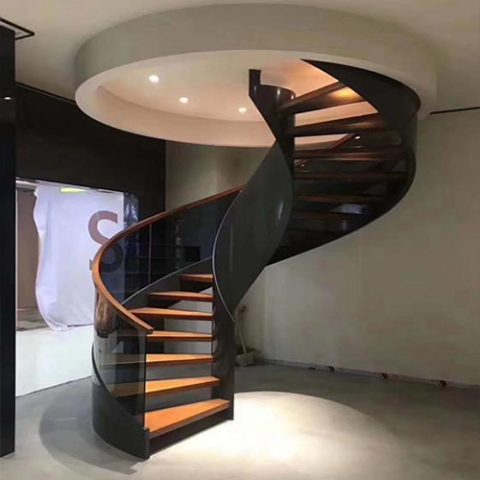
The image size is (480, 480). I want to click on topmost wooden step, so click(x=327, y=96).